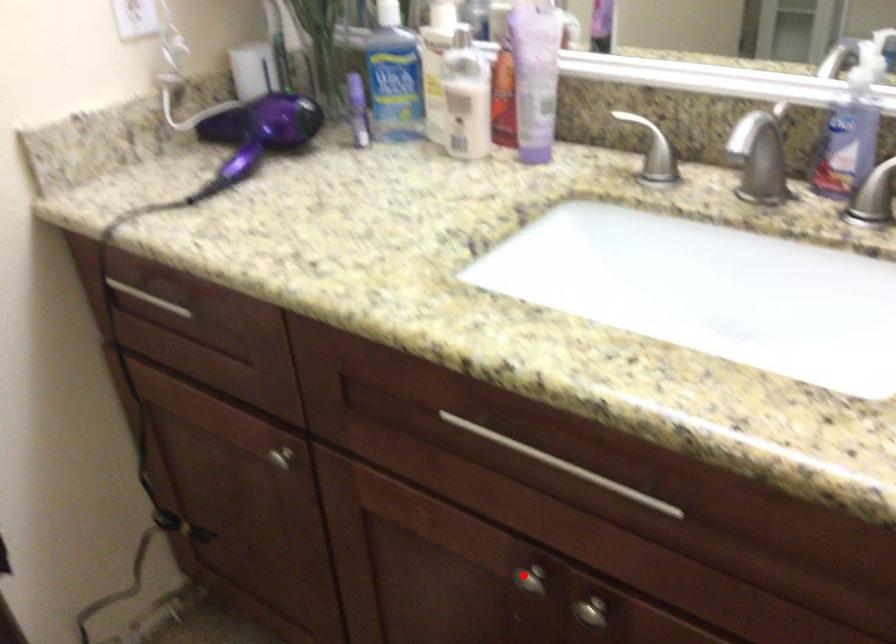
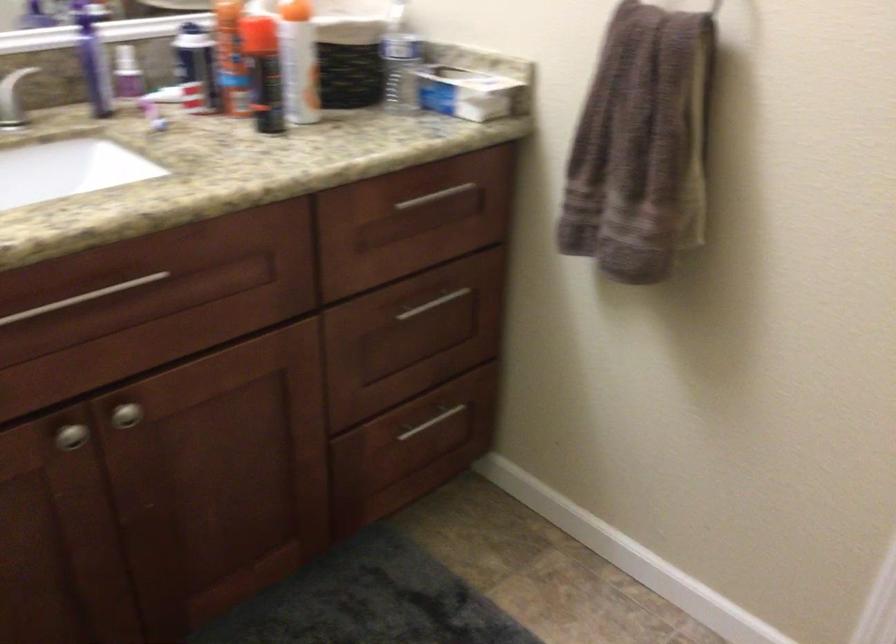
Question: I am providing you with two images of the same scene from different viewpoints. A red point is shown in image1. For the corresponding object point in image2, is it positioned nearer or farther from the camera?

Choices:
 (A) Nearer
 (B) Farther

Answer: (B)